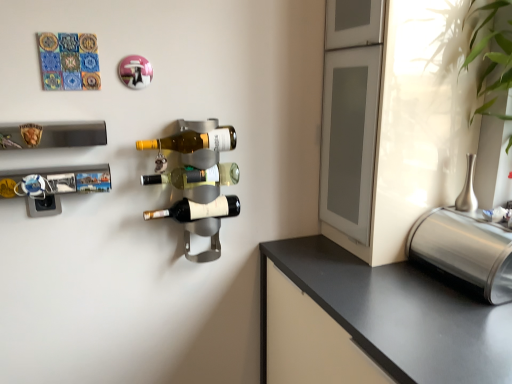
You are a GUI agent. You are given a task and a screenshot of the screen. Output one action in this format:
    pyautogui.click(x=<x>, y=<y>)
    Task: Click on the green leafy plant at upper right
    Image resolution: width=512 pixels, height=384 pixels.
    Given the screenshot: What is the action you would take?
    pyautogui.click(x=492, y=46)

Describe the element at coordinates (465, 244) in the screenshot. The height and width of the screenshot is (384, 512). I see `metallic cylindrical container at right` at that location.

The image size is (512, 384). Describe the element at coordinates (52, 134) in the screenshot. I see `black plastic wine rack at upper left, the 1th wine rack viewed from the top` at that location.

What is the approximate height of black plastic wine rack at upper left, the 1th wine rack viewed from the top?

2.99 inches.

The width and height of the screenshot is (512, 384). Find the location of `metallic silver wine rack at left, which appears as the 1th wine rack when ordered from the bottom`. metallic silver wine rack at left, which appears as the 1th wine rack when ordered from the bottom is located at coordinates (x=55, y=180).

Which of these two, translucent glass bottle at center, placed as the 2th beer bottle when sorted from bottom to top, or metallic cylindrical container at right, is thinner?

With smaller width is translucent glass bottle at center, placed as the 2th beer bottle when sorted from bottom to top.

How far apart are translucent glass bottle at center, which is the second beer bottle from top to bottom, and metallic cylindrical container at right?

They are 70.81 centimeters apart.

Is translucent glass bottle at center, placed as the 2th beer bottle when sorted from bottom to top, facing towards metallic cylindrical container at right?

No, translucent glass bottle at center, placed as the 2th beer bottle when sorted from bottom to top, is not facing towards metallic cylindrical container at right.

Is point (167, 179) closer to viewer compared to point (454, 264)?

No, (167, 179) is further to viewer.

From the image's perspective, which is below, black plastic wine rack at upper left, the 1th wine rack viewed from the top, or translucent glass bottle at center, which is the second beer bottle from top to bottom?

translucent glass bottle at center, which is the second beer bottle from top to bottom.

There is a translucent glass bottle at center, placed as the 2th beer bottle when sorted from bottom to top. At what (x,y) coordinates should I click in order to perform the action: click on the 2nd wine rack above it (from a real-world perspective). Please return your answer as a coordinate pair (x, y). Image resolution: width=512 pixels, height=384 pixels. Looking at the image, I should click on (52, 134).

Is black plastic wine rack at upper left, the second wine rack when ordered from bottom to top, turned away from translucent glass bottle at center, placed as the 2th beer bottle when sorted from bottom to top?

That's not correct — black plastic wine rack at upper left, the second wine rack when ordered from bottom to top, is not looking away from translucent glass bottle at center, placed as the 2th beer bottle when sorted from bottom to top.

Does black plastic wine rack at upper left, the 1th wine rack viewed from the top, lie behind translucent glass bottle at center, placed as the 2th beer bottle when sorted from bottom to top?

No, the depth of black plastic wine rack at upper left, the 1th wine rack viewed from the top, is less than that of translucent glass bottle at center, placed as the 2th beer bottle when sorted from bottom to top.

Is metallic cylindrical container at right oriented towards matte glass beer bottle at center, positioned as the third beer bottle in bottom-to-top order?

No, metallic cylindrical container at right is not facing towards matte glass beer bottle at center, positioned as the third beer bottle in bottom-to-top order.

Which is more to the right, metallic cylindrical container at right or matte glass beer bottle at center, which is the 1th beer bottle in top-to-bottom order?

Positioned to the right is metallic cylindrical container at right.

Is metallic cylindrical container at right positioned beyond the bounds of matte glass beer bottle at center, positioned as the third beer bottle in bottom-to-top order?

Yes, metallic cylindrical container at right is not within matte glass beer bottle at center, positioned as the third beer bottle in bottom-to-top order.

From the image's perspective, is black plastic wine rack at upper left, the second wine rack when ordered from bottom to top, above metallic silver wine rack at left, which appears as the 1th wine rack when ordered from the bottom?

Indeed, from the image's perspective, black plastic wine rack at upper left, the second wine rack when ordered from bottom to top, is shown above metallic silver wine rack at left, which appears as the 1th wine rack when ordered from the bottom.

Can you confirm if black plastic wine rack at upper left, the 1th wine rack viewed from the top, is positioned to the left of metallic silver wine rack at left, which appears as the 1th wine rack when ordered from the bottom?

Correct, you'll find black plastic wine rack at upper left, the 1th wine rack viewed from the top, to the left of metallic silver wine rack at left, which appears as the 1th wine rack when ordered from the bottom.

Does point (34, 131) lie behind point (0, 184)?

No, (34, 131) is closer to viewer.

Is green leafy plant at upper right beside translucent glass bottle at center, which is the second beer bottle from top to bottom?

There is a gap between green leafy plant at upper right and translucent glass bottle at center, which is the second beer bottle from top to bottom.

Is translucent glass bottle at center, which is the second beer bottle from top to bottom, completely or partially inside green leafy plant at upper right?

Definitely not — translucent glass bottle at center, which is the second beer bottle from top to bottom, is not inside green leafy plant at upper right.

Looking at their sizes, would you say green leafy plant at upper right is wider or thinner than translucent glass bottle at center, which is the second beer bottle from top to bottom?

green leafy plant at upper right is wider than translucent glass bottle at center, which is the second beer bottle from top to bottom.

Is point (494, 66) positioned before point (193, 178)?

Yes, it is in front of point (193, 178).

Considering the relative sizes of black plastic wine rack at upper left, the second wine rack when ordered from bottom to top, and metallic cylindrical container at right in the image provided, is black plastic wine rack at upper left, the second wine rack when ordered from bottom to top, taller than metallic cylindrical container at right?

In fact, black plastic wine rack at upper left, the second wine rack when ordered from bottom to top, may be shorter than metallic cylindrical container at right.

From the image's perspective, between black plastic wine rack at upper left, the second wine rack when ordered from bottom to top, and metallic cylindrical container at right, who is located below?

metallic cylindrical container at right is shown below in the image.

What's the angular difference between black plastic wine rack at upper left, the second wine rack when ordered from bottom to top, and metallic cylindrical container at right's facing directions?

The angle between the facing direction of black plastic wine rack at upper left, the second wine rack when ordered from bottom to top, and the facing direction of metallic cylindrical container at right is 89.6 degrees.

What are the coordinates of `the 2nd wine rack located above the metallic cylindrical container at right (from a real-world perspective)` in the screenshot? It's located at (52, 134).

Is green leafy plant at upper right wider than shiny metallic wine bottle at center, the 1th beer bottle from the bottom?

Correct, the width of green leafy plant at upper right exceeds that of shiny metallic wine bottle at center, the 1th beer bottle from the bottom.

From a real-world perspective, is green leafy plant at upper right on shiny metallic wine bottle at center, the 1th beer bottle from the bottom?

Yes.

From the picture: Considering the positions of objects green leafy plant at upper right and shiny metallic wine bottle at center, the 1th beer bottle from the bottom, in the image provided, who is behind, green leafy plant at upper right or shiny metallic wine bottle at center, the 1th beer bottle from the bottom,?

Positioned behind is shiny metallic wine bottle at center, the 1th beer bottle from the bottom.

Considering the relative sizes of green leafy plant at upper right and shiny metallic wine bottle at center, which ranks as the third beer bottle in top-to-bottom order, in the image provided, is green leafy plant at upper right taller than shiny metallic wine bottle at center, which ranks as the third beer bottle in top-to-bottom order,?

Correct, green leafy plant at upper right is much taller as shiny metallic wine bottle at center, which ranks as the third beer bottle in top-to-bottom order.

Locate an element on the screen. the 2nd beer bottle behind the metallic cylindrical container at right is located at coordinates (196, 176).

At what (x,y) coordinates should I click in order to perform the action: click on the 1st beer bottle below the black plastic wine rack at upper left, the second wine rack when ordered from bottom to top (from the image's perspective). Please return your answer as a coordinate pair (x, y). The height and width of the screenshot is (384, 512). Looking at the image, I should click on (196, 176).

Looking at this image, considering their positions, is black plastic wine rack at upper left, the second wine rack when ordered from bottom to top, positioned closer to metallic silver wine rack at left, the 2th wine rack when ordered from top to bottom, than translucent glass bottle at center, placed as the 2th beer bottle when sorted from bottom to top?

Based on the image, black plastic wine rack at upper left, the second wine rack when ordered from bottom to top, appears to be nearer to metallic silver wine rack at left, the 2th wine rack when ordered from top to bottom.

When comparing their distances from black plastic wine rack at upper left, the 1th wine rack viewed from the top, does shiny metallic wine bottle at center, the 1th beer bottle from the bottom, or translucent glass bottle at center, which is the second beer bottle from top to bottom, seem closer?

The object closer to black plastic wine rack at upper left, the 1th wine rack viewed from the top, is translucent glass bottle at center, which is the second beer bottle from top to bottom.

When comparing their distances from green leafy plant at upper right, does metallic silver wine rack at left, which appears as the 1th wine rack when ordered from the bottom, or translucent glass bottle at center, placed as the 2th beer bottle when sorted from bottom to top, seem further?

metallic silver wine rack at left, which appears as the 1th wine rack when ordered from the bottom, is further to green leafy plant at upper right.

Looking at the image, which one is located further to green leafy plant at upper right, black plastic wine rack at upper left, the 1th wine rack viewed from the top, or metallic cylindrical container at right?

black plastic wine rack at upper left, the 1th wine rack viewed from the top, is further to green leafy plant at upper right.

When comparing their distances from translucent glass bottle at center, which is the second beer bottle from top to bottom, does matte glass beer bottle at center, which is the 1th beer bottle in top-to-bottom order, or green leafy plant at upper right seem closer?

The object closer to translucent glass bottle at center, which is the second beer bottle from top to bottom, is matte glass beer bottle at center, which is the 1th beer bottle in top-to-bottom order.

Based on their spatial positions, is metallic silver wine rack at left, the 2th wine rack when ordered from top to bottom, or metallic cylindrical container at right further from black plastic wine rack at upper left, the second wine rack when ordered from bottom to top?

metallic cylindrical container at right is positioned further to the anchor black plastic wine rack at upper left, the second wine rack when ordered from bottom to top.

Consider the image. Estimate the real-world distances between objects in this image. Which object is closer to shiny metallic wine bottle at center, the 1th beer bottle from the bottom, green leafy plant at upper right or metallic cylindrical container at right?

metallic cylindrical container at right.

Based on their spatial positions, is black plastic wine rack at upper left, the 1th wine rack viewed from the top, or green leafy plant at upper right closer to shiny metallic wine bottle at center, which ranks as the third beer bottle in top-to-bottom order?

black plastic wine rack at upper left, the 1th wine rack viewed from the top, lies closer to shiny metallic wine bottle at center, which ranks as the third beer bottle in top-to-bottom order, than the other object.

At what (x,y) coordinates should I click in order to perform the action: click on wine rack located between black plastic wine rack at upper left, the second wine rack when ordered from bottom to top, and matte glass beer bottle at center, positioned as the third beer bottle in bottom-to-top order, in the left-right direction. Please return your answer as a coordinate pair (x, y). The image size is (512, 384). Looking at the image, I should click on (55, 180).

The height and width of the screenshot is (384, 512). I want to click on beer bottle that lies between matte glass beer bottle at center, which is the 1th beer bottle in top-to-bottom order, and shiny metallic wine bottle at center, which ranks as the third beer bottle in top-to-bottom order, from top to bottom, so 196,176.

Locate an element on the screen. This screenshot has width=512, height=384. appliance located between translucent glass bottle at center, placed as the 2th beer bottle when sorted from bottom to top, and green leafy plant at upper right in the left-right direction is located at coordinates (465, 244).

Image resolution: width=512 pixels, height=384 pixels. In order to click on wine rack located between black plastic wine rack at upper left, the 1th wine rack viewed from the top, and translucent glass bottle at center, which is the second beer bottle from top to bottom, in the left-right direction in this screenshot , I will do `click(55, 180)`.